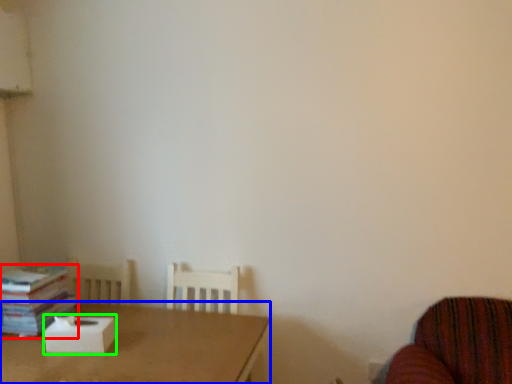
Question: Which object is the closest to the book (highlighted by a red box)? Choose among these: table (highlighted by a blue box) or cardboard box (highlighted by a green box).

Choices:
 (A) table
 (B) cardboard box

Answer: (B)